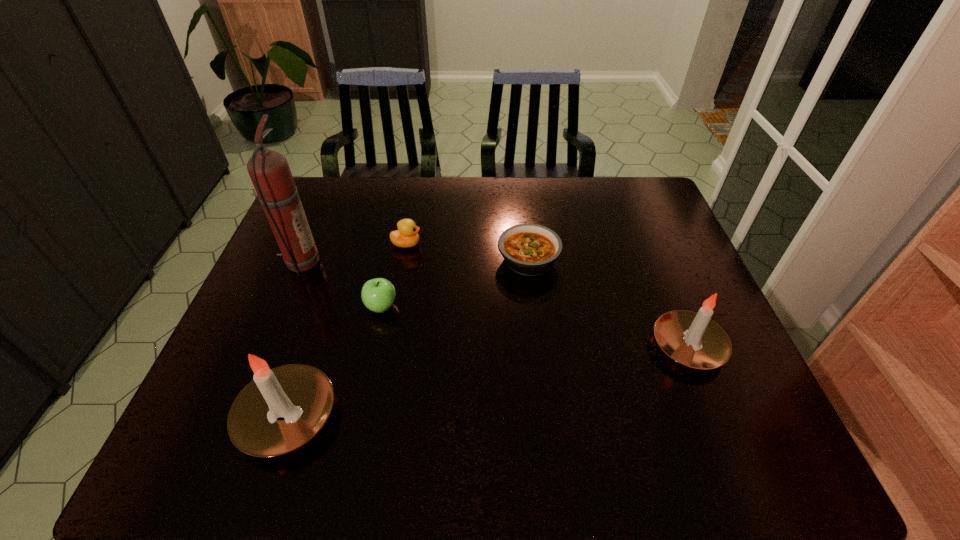
In order to click on vacant space at the far edge of the desktop in this screenshot , I will do (x=433, y=195).

Where is `vacant space at the near edge of the desktop`? The height and width of the screenshot is (540, 960). vacant space at the near edge of the desktop is located at coordinates (472, 401).

In the image, there is a desktop. Identify the location of vacant space at the left edge. The height and width of the screenshot is (540, 960). (308, 298).

In the image, there is a desktop. Where is `blank space at the right edge`? blank space at the right edge is located at coordinates (664, 302).

You are a GUI agent. You are given a task and a screenshot of the screen. Output one action in this format:
    pyautogui.click(x=<x>, y=<y>)
    Task: Click on the vacant space at the far right corner of the desktop
    This screenshot has height=540, width=960.
    Given the screenshot: What is the action you would take?
    pyautogui.click(x=653, y=210)

Find the location of `free space at the near right corner of the desktop`. free space at the near right corner of the desktop is located at coordinates tap(764, 408).

Find the location of a particular element. Image resolution: width=960 pixels, height=540 pixels. free space that is in between the fifth object from left to right and the apple is located at coordinates (455, 283).

Image resolution: width=960 pixels, height=540 pixels. Find the location of `free space between the shorter candle and the duckling`. free space between the shorter candle and the duckling is located at coordinates (547, 295).

Where is `free area in between the second tallest object and the tallest object`? This screenshot has height=540, width=960. free area in between the second tallest object and the tallest object is located at coordinates 294,340.

Image resolution: width=960 pixels, height=540 pixels. In order to click on free space between the fire extinguisher and the duckling in this screenshot , I will do `click(353, 254)`.